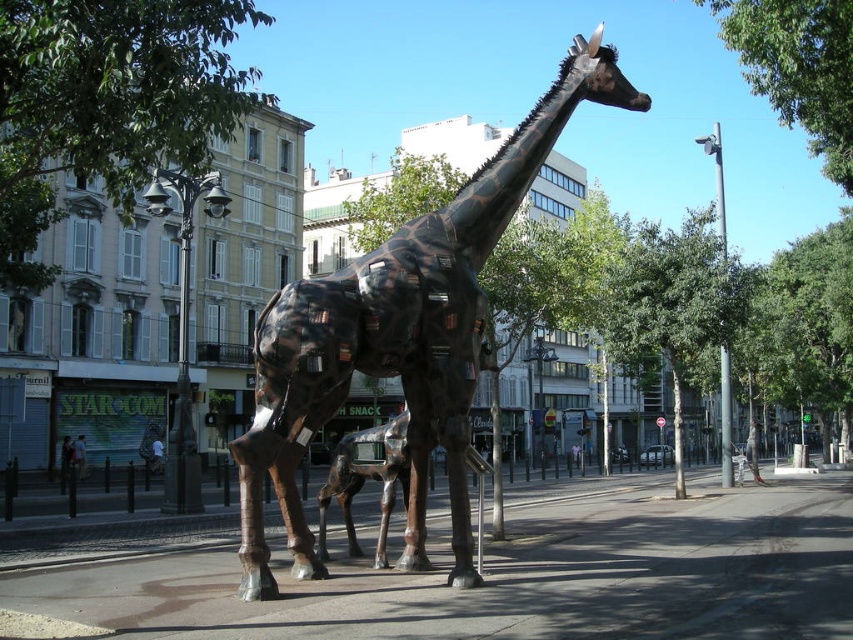
Who is taller, green leafy tree at center or green leafy tree at upper center?

Standing taller between the two is green leafy tree at upper center.

This screenshot has height=640, width=853. Identify the location of green leafy tree at center. (671, 307).

Identify the location of green leafy tree at center. This screenshot has height=640, width=853. (671, 307).

Is concrete pavement at center above bronze textured giraffe at center?

Actually, concrete pavement at center is below bronze textured giraffe at center.

Which is below, concrete pavement at center or bronze textured giraffe at center?

concrete pavement at center is lower down.

Does point (209, 595) come farther from viewer compared to point (277, 480)?

No.

Locate an element on the screen. Image resolution: width=853 pixels, height=640 pixels. concrete pavement at center is located at coordinates (520, 577).

Which is below, bronze textured giraffe at center or green leafy tree at center?

bronze textured giraffe at center is below.

Who is more forward, (457, 547) or (701, 262)?

Point (457, 547) is more forward.

I want to click on bronze textured giraffe at center, so click(399, 337).